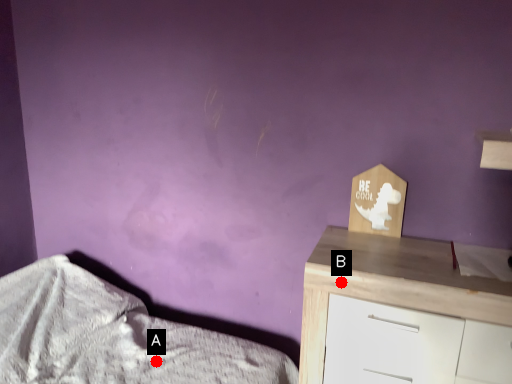
Question: Two points are circled on the image, labeled by A and B beside each circle. Which of the following is the closest to the observer?

Choices:
 (A) A is closer
 (B) B is closer

Answer: (B)